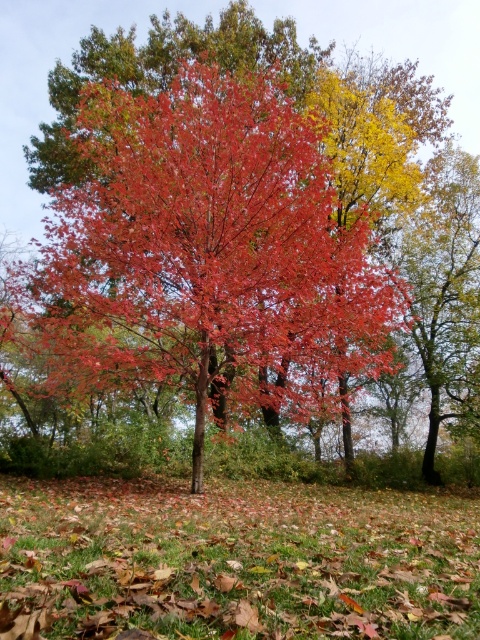
Question: Does shiny red maple tree at center have a greater width compared to brown grass at lower center?

Choices:
 (A) no
 (B) yes

Answer: (B)

Question: Is shiny red maple tree at center smaller than brown grass at lower center?

Choices:
 (A) no
 (B) yes

Answer: (A)

Question: Which object is closer to the camera taking this photo?

Choices:
 (A) brown grass at lower center
 (B) shiny red maple tree at center

Answer: (A)

Question: Among these points, which one is farthest from the camera?

Choices:
 (A) tap(80, 273)
 (B) tap(406, 630)

Answer: (A)

Question: Can you confirm if shiny red maple tree at center is positioned to the left of brown grass at lower center?

Choices:
 (A) no
 (B) yes

Answer: (B)